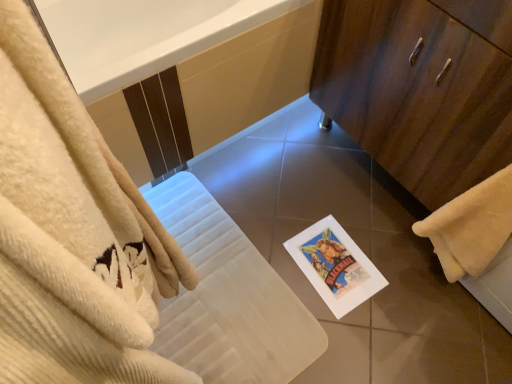
The width and height of the screenshot is (512, 384). I want to click on free space to the back side of white paper postcard at center, so click(330, 205).